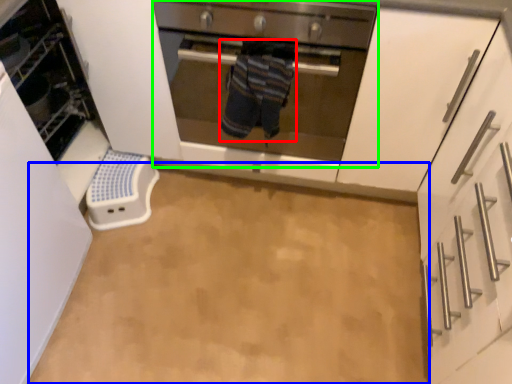
Question: Estimate the real-world distances between objects in this image. Which object is closer to person (highlighted by a red box), plain (highlighted by a blue box) or oven (highlighted by a green box)?

Choices:
 (A) plain
 (B) oven

Answer: (B)